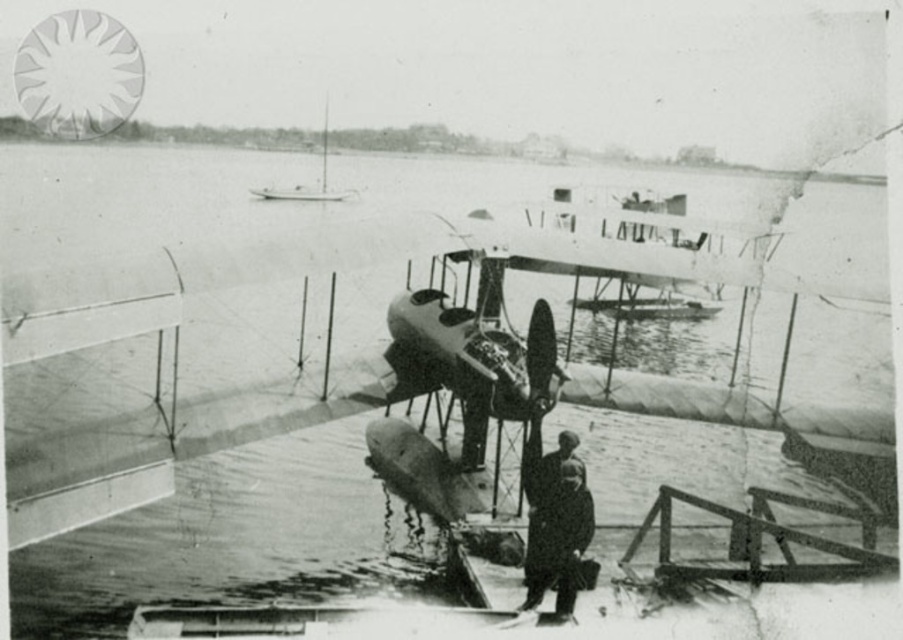
You are a photographer in 1930s, and you want to take a photo of the dark gray uniform at center. Where should you position your camera to capture it clearly?

You should position your camera at a point where it can focus on the coordinates provided for the dark gray uniform at center, which is at point (554, 518).

In the scene shown: You are a pilot preparing to board the seaplane at the wooden platform. You notice a specific point marked at coordinates (x=554, y=518) on the image. What object or feature is located at that coordinate?

The point at coordinates (x=554, y=518) indicates the dark gray uniform at center.